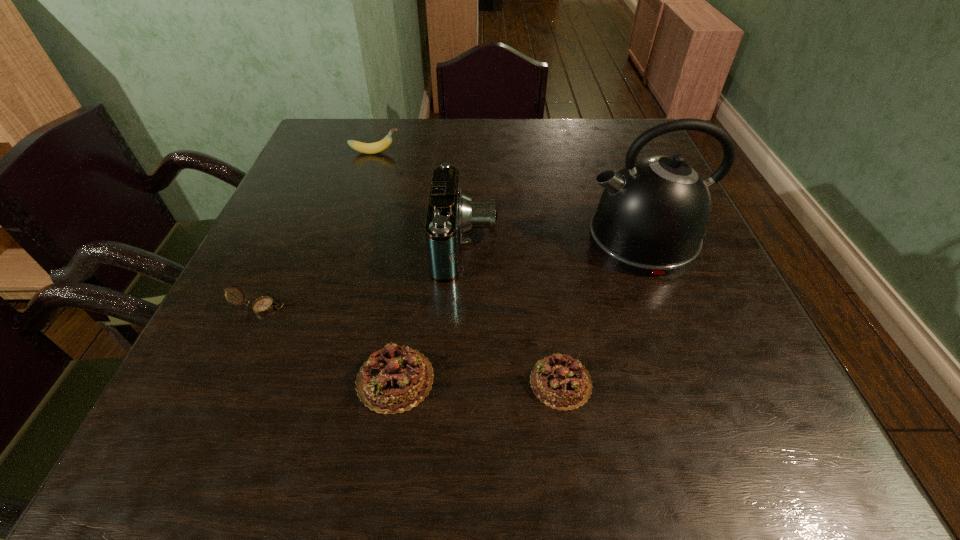
I want to click on free point that keeps the chocolate cakes evenly spaced on the right, so click(x=729, y=385).